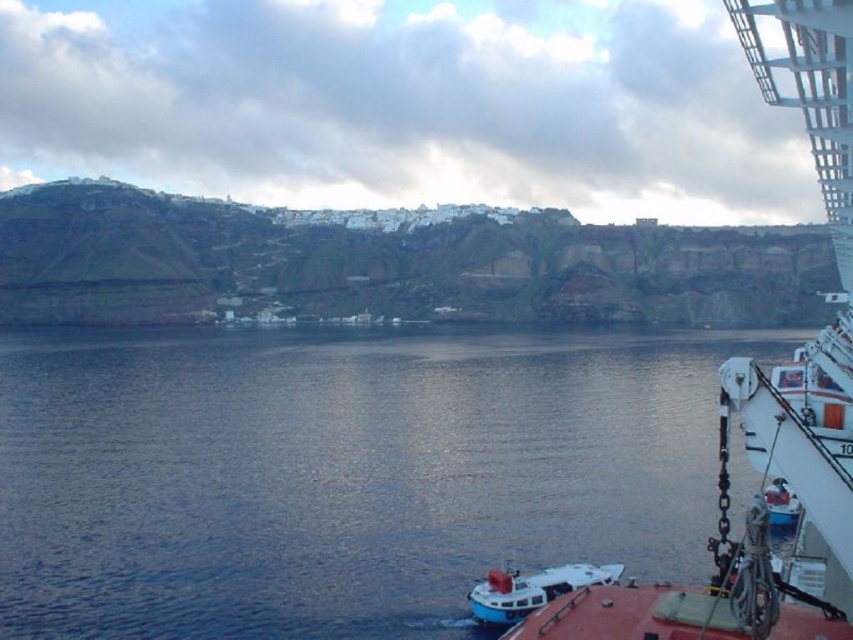
Question: Can you confirm if dark blue water at lower left is positioned to the right of white matte boat at lower center?

Choices:
 (A) no
 (B) yes

Answer: (A)

Question: Which object is positioned closest to the green grassy hillside at upper left?

Choices:
 (A) white matte boat at lower center
 (B) dark blue water at lower left

Answer: (B)

Question: Which object appears farthest from the camera in this image?

Choices:
 (A) white matte boat at lower center
 (B) dark blue water at lower left
 (C) white glossy cruise ship at right
 (D) green grassy hillside at upper left

Answer: (D)

Question: Is dark blue water at lower left closer to the viewer compared to green grassy hillside at upper left?

Choices:
 (A) no
 (B) yes

Answer: (B)

Question: Can you confirm if green grassy hillside at upper left is positioned to the right of white matte boat at lower center?

Choices:
 (A) yes
 (B) no

Answer: (B)

Question: Which point appears farthest from the camera in this image?

Choices:
 (A) (544, 387)
 (B) (543, 588)
 (C) (809, 637)

Answer: (A)